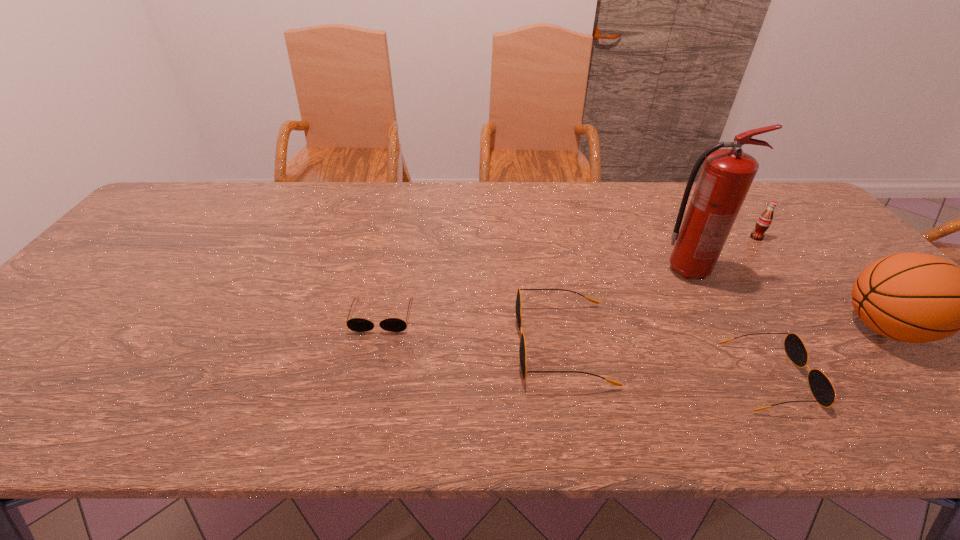
Considering the uniform spacing of sunglassess, where should an additional sunglasses be positioned on the left? Please locate a free spot. Please provide its 2D coordinates. Your answer should be formatted as a tuple, i.e. [(x, y)], where the tuple contains the x and y coordinates of a point satisfying the conditions above.

[(223, 289)]